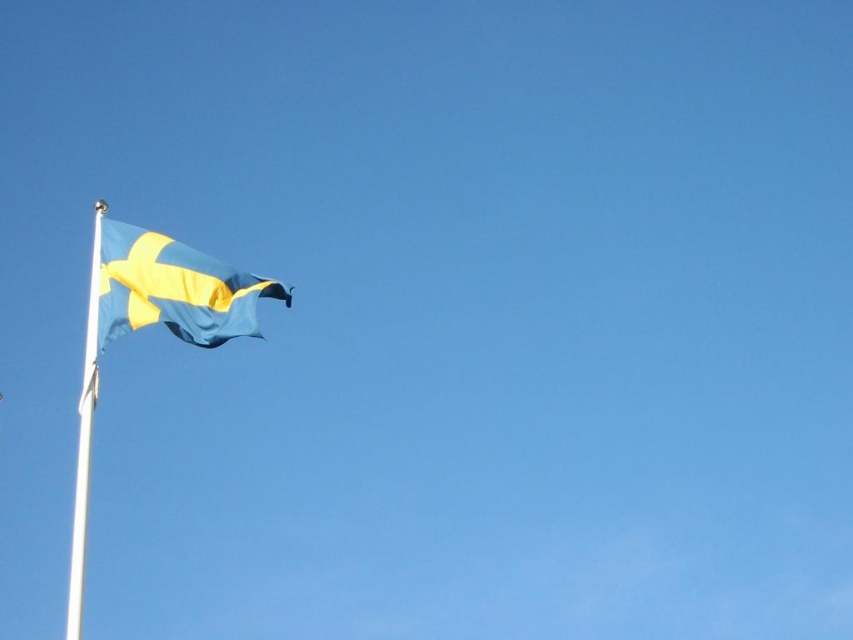
Question: Is the position of blue fabric flag at upper left less distant than that of white metallic flag pole at left?

Choices:
 (A) no
 (B) yes

Answer: (A)

Question: Which object is closer to the camera taking this photo?

Choices:
 (A) blue fabric flag at upper left
 (B) white metallic flag pole at left

Answer: (B)

Question: Which of the following is the closest to the observer?

Choices:
 (A) blue fabric flag at upper left
 (B) white metallic flag pole at left

Answer: (B)

Question: Does blue fabric flag at upper left have a greater width compared to white metallic flag pole at left?

Choices:
 (A) yes
 (B) no

Answer: (B)

Question: Is blue fabric flag at upper left to the left of white metallic flag pole at left from the viewer's perspective?

Choices:
 (A) no
 (B) yes

Answer: (A)